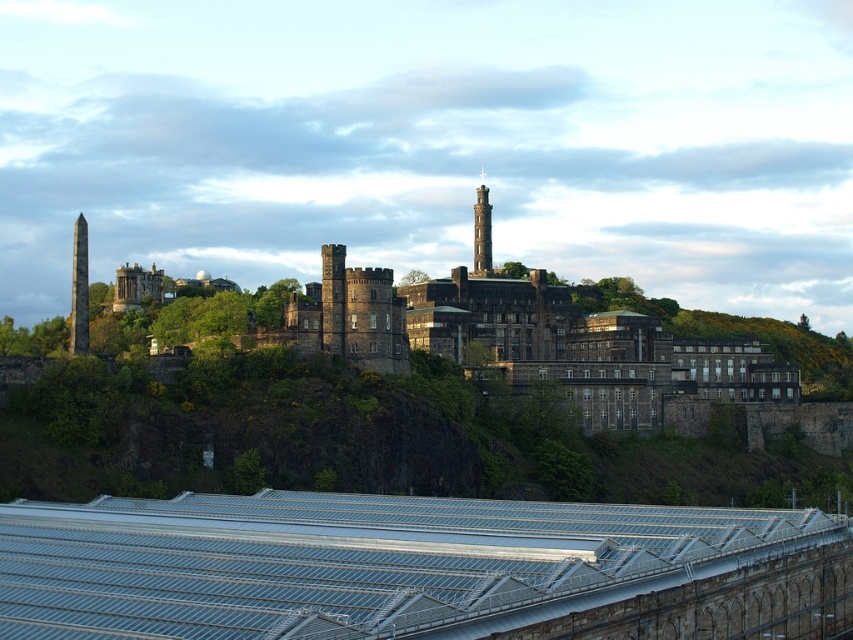
Does point (22, 579) come behind point (82, 232)?

No, (22, 579) is closer to viewer.

Is metallic gray roof at lower center wider than brown stone obelisk at left?

Yes, metallic gray roof at lower center is wider than brown stone obelisk at left.

Is point (248, 524) less distant than point (70, 353)?

Yes, it is.

Identify the location of metallic gray roof at lower center. (416, 570).

Measure the distance between metallic gray roof at lower center and smooth stone chimney at center.

metallic gray roof at lower center is 123.91 meters from smooth stone chimney at center.

Between metallic gray roof at lower center and smooth stone chimney at center, which one has less height?

Standing shorter between the two is metallic gray roof at lower center.

What do you see at coordinates (416, 570) in the screenshot?
I see `metallic gray roof at lower center` at bounding box center [416, 570].

Image resolution: width=853 pixels, height=640 pixels. What are the coordinates of `metallic gray roof at lower center` in the screenshot? It's located at (416, 570).

Who is positioned more to the right, brown stone obelisk at left or smooth stone chimney at center?

smooth stone chimney at center is more to the right.

Is point (73, 344) farther from camera compared to point (490, 218)?

No.

The height and width of the screenshot is (640, 853). In order to click on brown stone obelisk at left in this screenshot , I will do `click(79, 289)`.